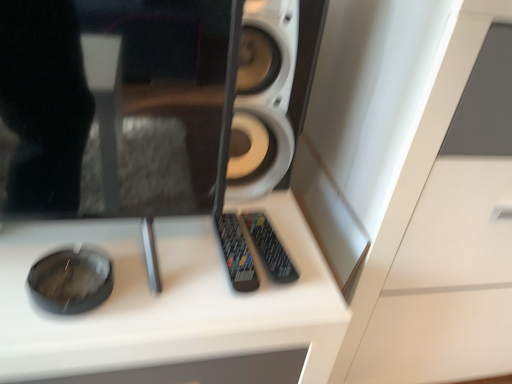
Question: Do you think white matte speaker at center is within white glossy dresser at center, or outside of it?

Choices:
 (A) inside
 (B) outside

Answer: (B)

Question: From the image's perspective, is white matte speaker at center above or below white glossy dresser at center?

Choices:
 (A) above
 (B) below

Answer: (A)

Question: Which is farther from the black plastic remote at center, arranged as the 1th control when viewed from the right?

Choices:
 (A) white glossy dresser at center
 (B) black plastic remote at center, arranged as the first control when viewed from the left
 (C) white matte speaker at center

Answer: (A)

Question: Considering the real-world distances, which object is farthest from the white matte speaker at center?

Choices:
 (A) white glossy dresser at center
 (B) black plastic remote at center, which is the second control from right to left
 (C) black plastic remote at center, which is counted as the second control, starting from the left

Answer: (A)